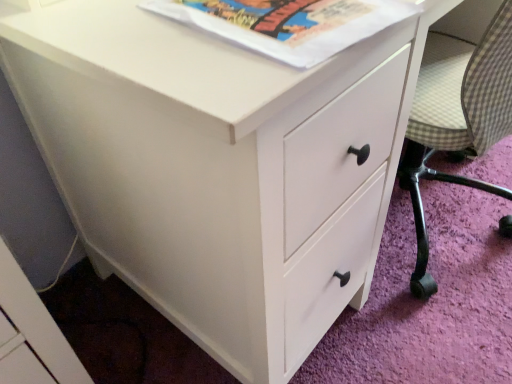
Question: From a real-world perspective, is white paper at upper center positioned under checkered fabric armchair at right based on gravity?

Choices:
 (A) yes
 (B) no

Answer: (B)

Question: Does white paper at upper center have a larger size compared to checkered fabric armchair at right?

Choices:
 (A) yes
 (B) no

Answer: (B)

Question: Are white paper at upper center and checkered fabric armchair at right far apart?

Choices:
 (A) yes
 (B) no

Answer: (B)

Question: Can you confirm if white paper at upper center is thinner than checkered fabric armchair at right?

Choices:
 (A) no
 (B) yes

Answer: (B)

Question: Would you say checkered fabric armchair at right is part of white paper at upper center's contents?

Choices:
 (A) no
 (B) yes

Answer: (A)

Question: Can you confirm if white paper at upper center is positioned to the right of checkered fabric armchair at right?

Choices:
 (A) yes
 (B) no

Answer: (B)

Question: Is white paper at upper center completely or partially inside checkered fabric armchair at right?

Choices:
 (A) yes
 (B) no

Answer: (B)

Question: Can you confirm if checkered fabric armchair at right is wider than white paper at upper center?

Choices:
 (A) no
 (B) yes

Answer: (B)

Question: Is checkered fabric armchair at right in front of white paper at upper center?

Choices:
 (A) no
 (B) yes

Answer: (A)

Question: From the image's perspective, is checkered fabric armchair at right located beneath white paper at upper center?

Choices:
 (A) no
 (B) yes

Answer: (B)

Question: Is checkered fabric armchair at right bigger than white paper at upper center?

Choices:
 (A) no
 (B) yes

Answer: (B)

Question: Is checkered fabric armchair at right looking in the opposite direction of white paper at upper center?

Choices:
 (A) yes
 (B) no

Answer: (B)

Question: From a real-world perspective, is white paper at upper center above or below checkered fabric armchair at right?

Choices:
 (A) below
 (B) above

Answer: (B)